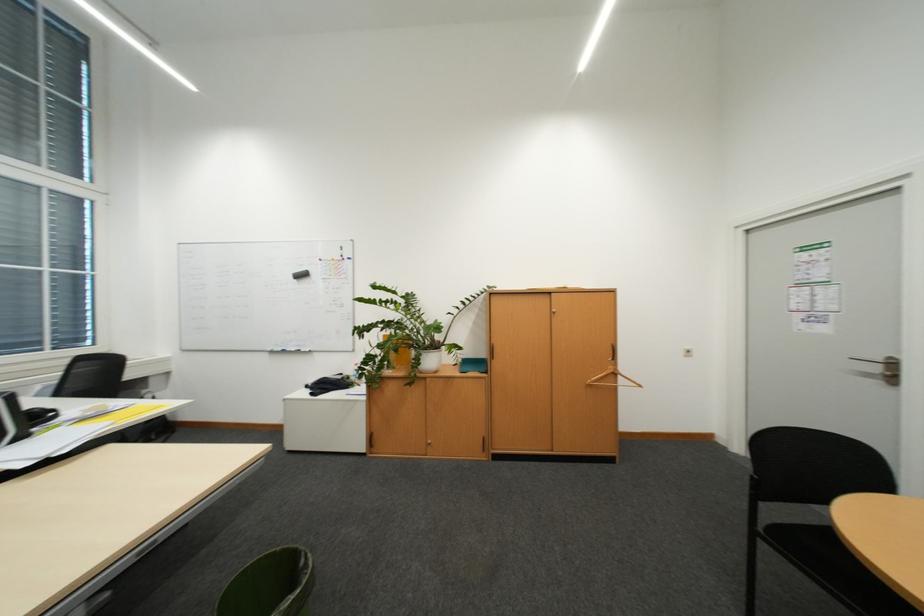
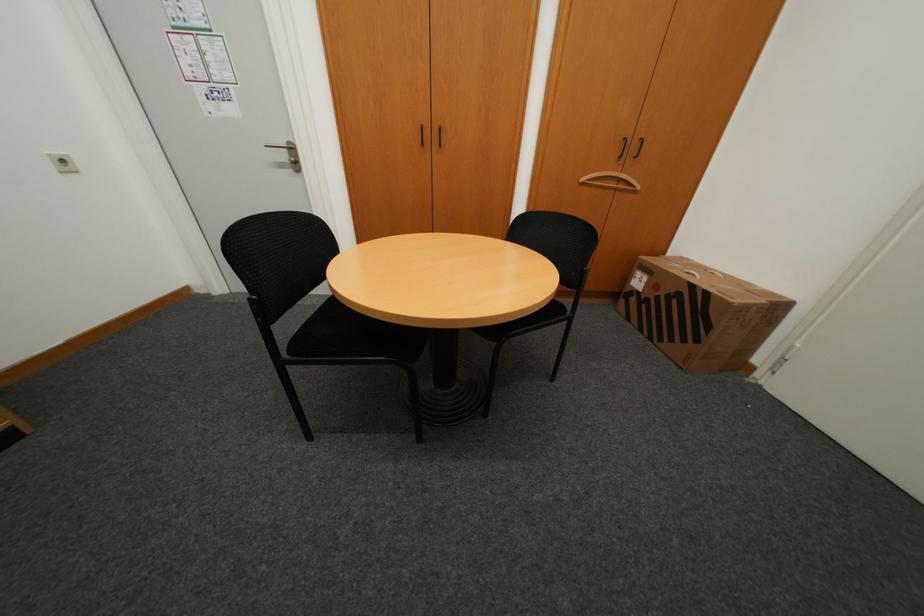
Based on the continuous images, in which direction is the camera rotating?

The camera rotated toward right-down.